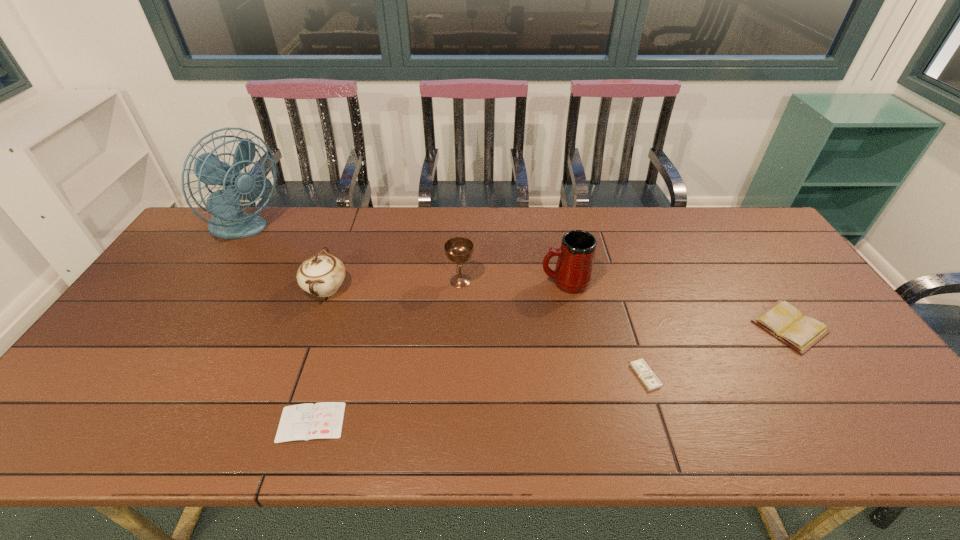
At what (x,y) coordinates should I click in order to perform the action: click on vacant space situated on the back of the left diary. Please return your answer as a coordinate pair (x, y). This screenshot has width=960, height=540. Looking at the image, I should click on (323, 384).

Where is `object situated at the far edge`? object situated at the far edge is located at coordinates (228, 222).

You are a GUI agent. You are given a task and a screenshot of the screen. Output one action in this format:
    pyautogui.click(x=<x>, y=<y>)
    Task: Click on the object present at the near edge
    This screenshot has height=540, width=960.
    Given the screenshot: What is the action you would take?
    pyautogui.click(x=322, y=420)

This screenshot has width=960, height=540. In order to click on object that is at the left edge in this screenshot , I will do `click(228, 222)`.

Identify the location of object positioned at the right edge. This screenshot has height=540, width=960. (784, 321).

Where is `object present at the far left corner`? The image size is (960, 540). object present at the far left corner is located at coordinates (228, 222).

In order to click on vacant space at the far edge of the desktop in this screenshot , I will do `click(374, 209)`.

In the image, there is a desktop. At what (x,y) coordinates should I click in order to perform the action: click on vacant area at the near edge. Please return your answer as a coordinate pair (x, y). This screenshot has height=540, width=960. Looking at the image, I should click on (670, 413).

In order to click on free region at the left edge in this screenshot , I will do `click(104, 368)`.

In order to click on free region at the right edge in this screenshot , I will do [804, 310].